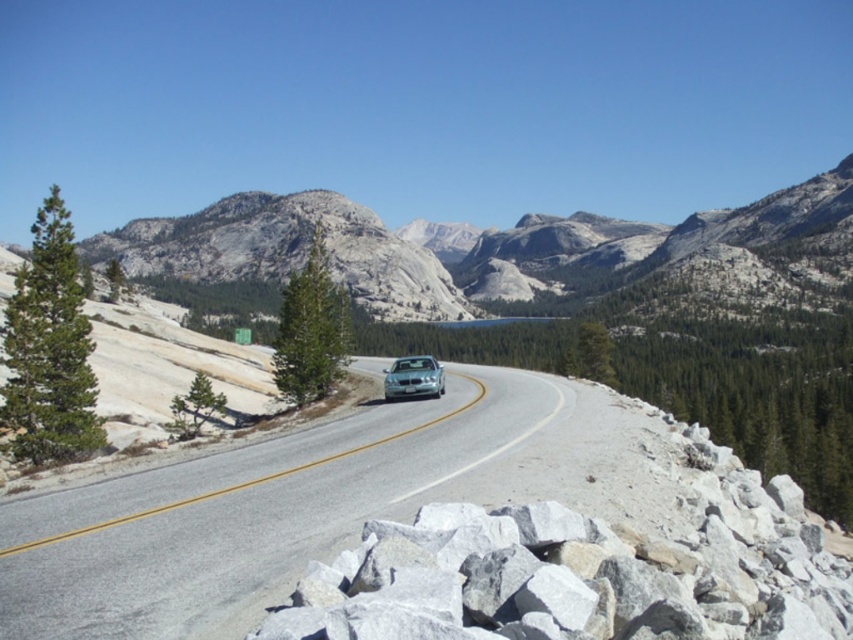
Question: Can you confirm if gray granite mountain at center is positioned above sleek silver sedan at center?

Choices:
 (A) yes
 (B) no

Answer: (A)

Question: Which point is farther to the camera?

Choices:
 (A) (653, 230)
 (B) (686, 456)

Answer: (A)

Question: Does silver metallic car at center come in front of gray granite mountain at center?

Choices:
 (A) yes
 (B) no

Answer: (A)

Question: Which point is farther to the camera?

Choices:
 (A) gray granite mountain at center
 (B) silver metallic car at center
 (C) sleek silver sedan at center

Answer: (A)

Question: Can you confirm if silver metallic car at center is positioned above gray granite mountain at center?

Choices:
 (A) yes
 (B) no

Answer: (B)

Question: Estimate the real-world distances between objects in this image. Which object is closer to the sleek silver sedan at center?

Choices:
 (A) gray rock at center
 (B) gray granite mountain at center
 (C) silver metallic car at center

Answer: (C)